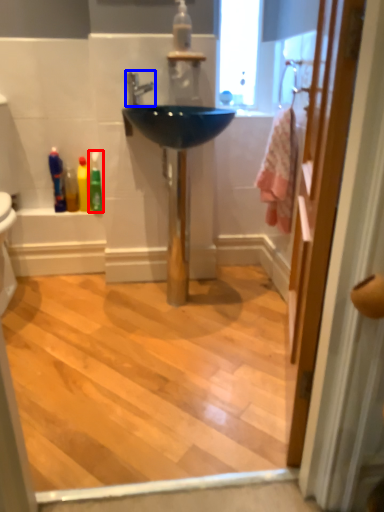
Question: Which point is closer to the camera, toiletry (highlighted by a red box) or tap (highlighted by a blue box)?

Choices:
 (A) toiletry
 (B) tap

Answer: (B)